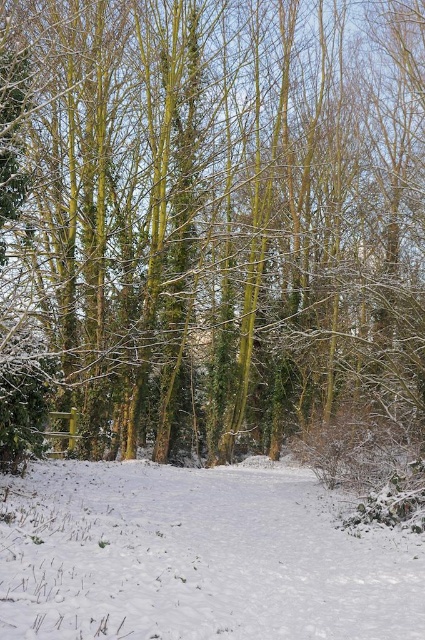
Question: Is snow-covered trees at center below white powdery snow at center?

Choices:
 (A) no
 (B) yes

Answer: (A)

Question: Is snow-covered trees at center below white powdery snow at center?

Choices:
 (A) yes
 (B) no

Answer: (B)

Question: Which point appears closest to the camera in this image?

Choices:
 (A) (141, 317)
 (B) (286, 502)

Answer: (B)

Question: Which object appears farthest from the camera in this image?

Choices:
 (A) snow-covered trees at center
 (B) white powdery snow at center

Answer: (A)

Question: Is snow-covered trees at center closer to camera compared to white powdery snow at center?

Choices:
 (A) yes
 (B) no

Answer: (B)